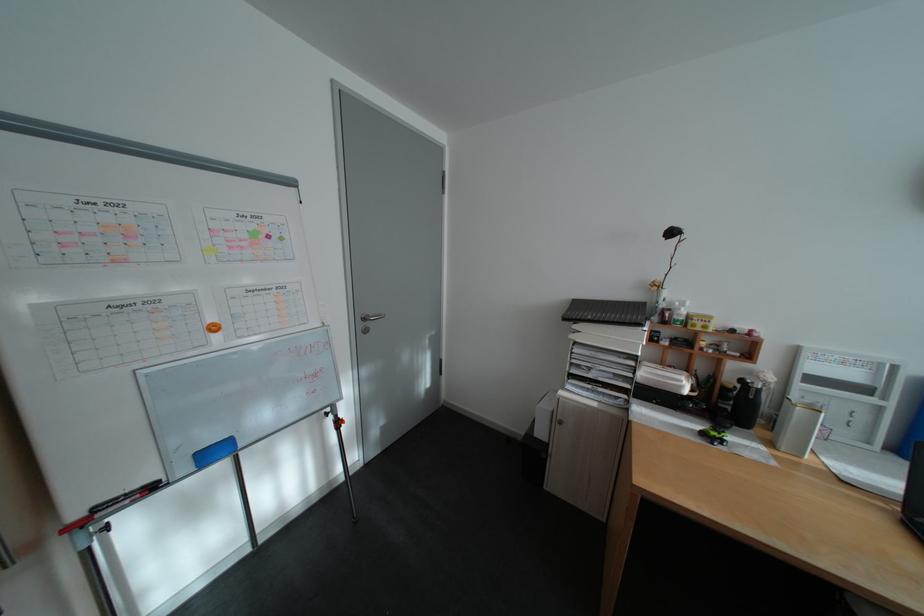
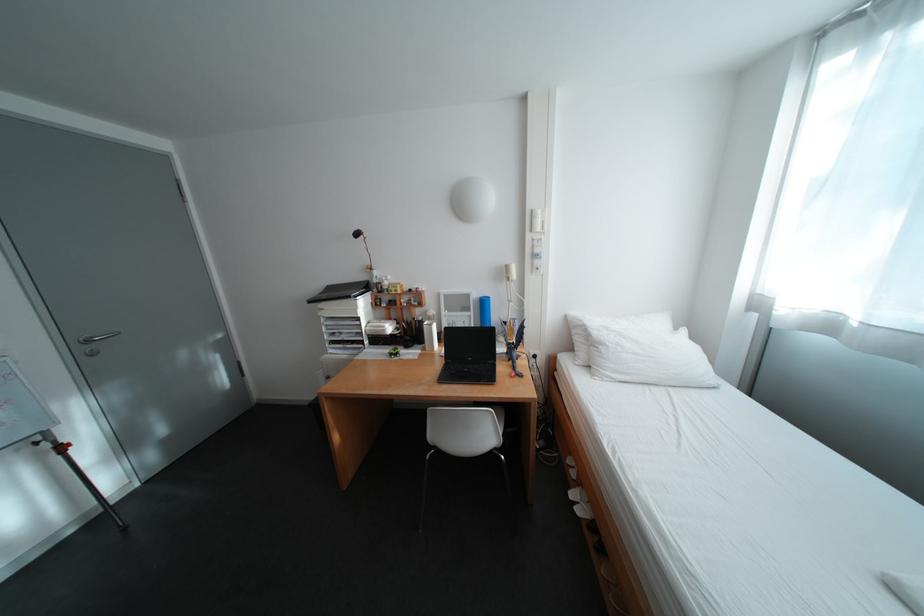
In the second image, find the point that corresponds to (x=378, y=320) in the first image.

(100, 342)